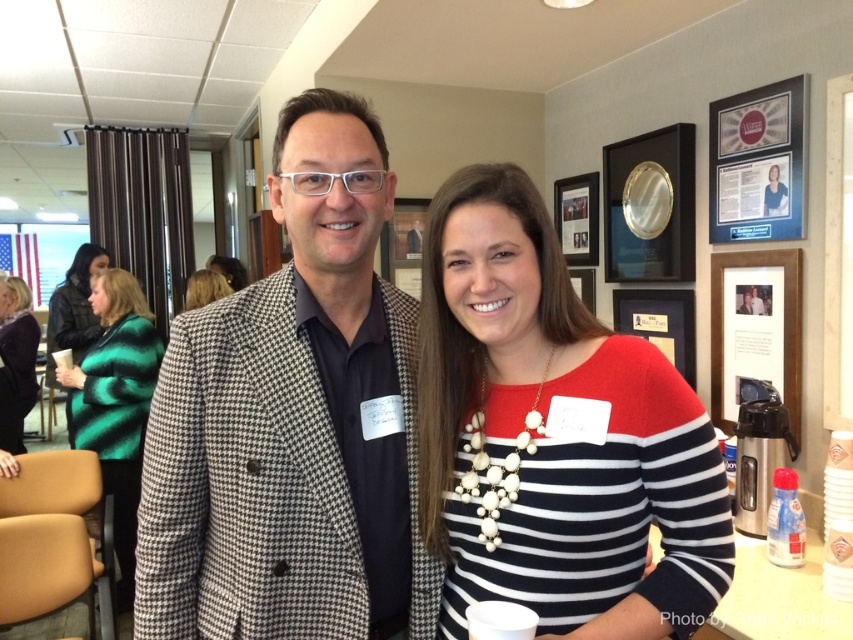
You are at a party and need to find the patterned blazer at center and the green striped sweater at left. Which one is higher up in the image?

The patterned blazer at center is above the green striped sweater at left in the image.

You are at a networking event and need to decide which item to take with you quickly. The green textured sweater at lower left and the matte black blazer at center are both on a rack nearby. Which one has a wider width?

The green textured sweater at lower left has a larger width than the matte black blazer at center.

What is the exact location of the striped knit sweater at center in the image?

The striped knit sweater at center is located at point (553, 436).